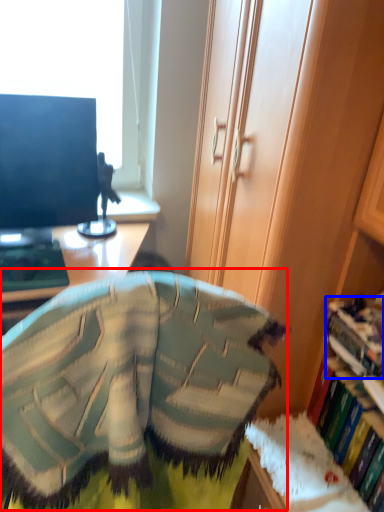
Question: Which point is further to the camera, bean bag chair (highlighted by a red box) or book (highlighted by a blue box)?

Choices:
 (A) bean bag chair
 (B) book

Answer: (B)